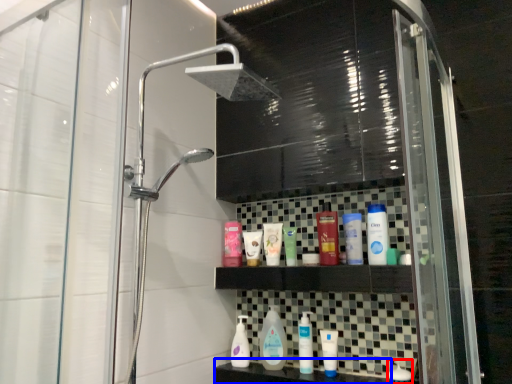
Question: Among these objects, which one is nearest to the camera, toiletry (highlighted by a red box) or counter top (highlighted by a blue box)?

Choices:
 (A) toiletry
 (B) counter top

Answer: (B)